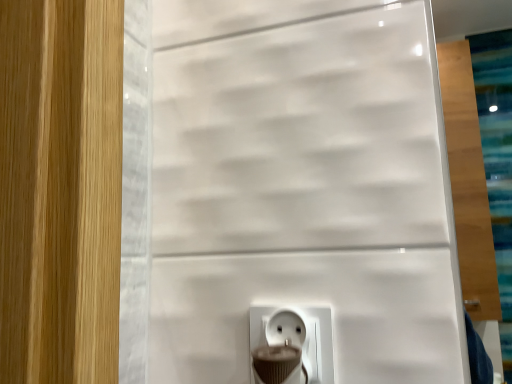
Locate an element on the screen. Image resolution: width=512 pixels, height=384 pixels. white plastic power plug at lower center is located at coordinates (297, 338).

What do you see at coordinates (297, 338) in the screenshot? Image resolution: width=512 pixels, height=384 pixels. I see `white plastic power plug at lower center` at bounding box center [297, 338].

Locate an element on the screen. Image resolution: width=512 pixels, height=384 pixels. white plastic power plug at lower center is located at coordinates (297, 338).